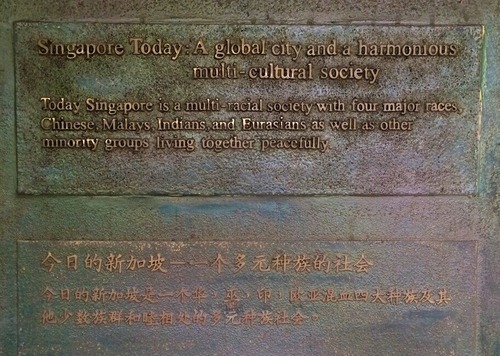
This screenshot has width=500, height=356. I want to click on plaque, so click(373, 176).